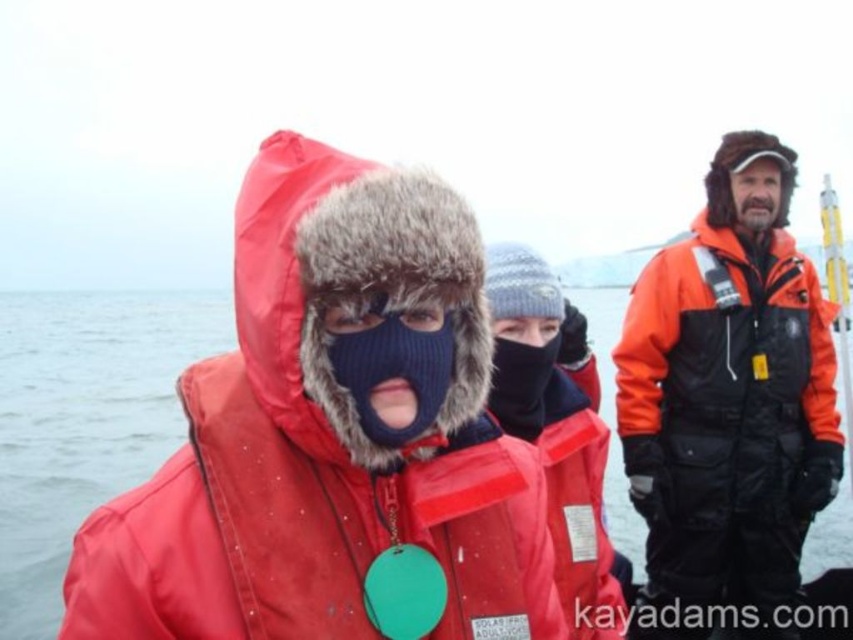
Question: Which object is closer to the camera taking this photo?

Choices:
 (A) bearded man at center
 (B) knitted wool beanie at center

Answer: (B)

Question: Does knitted dark blue mask at center have a greater width compared to green plastic medal at center?

Choices:
 (A) no
 (B) yes

Answer: (B)

Question: Can you confirm if matte red jacket at center is wider than fuzzy knit goggles at center?

Choices:
 (A) yes
 (B) no

Answer: (A)

Question: Can you confirm if orange synthetic jacket at center is positioned below bearded man at center?

Choices:
 (A) no
 (B) yes

Answer: (B)

Question: Which point is farther from the camera taking this photo?

Choices:
 (A) (361, 326)
 (B) (518, 324)

Answer: (B)

Question: Which point is farther from the camera taking this photo?

Choices:
 (A) coord(405,307)
 (B) coord(747,532)
 (C) coord(407,616)
 (D) coord(416,195)

Answer: (B)